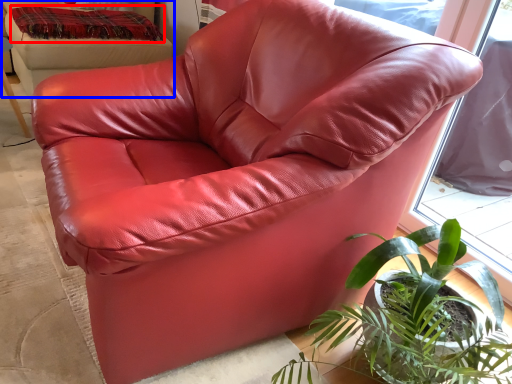
Question: Among these objects, which one is farthest to the camera, blanket (highlighted by a red box) or bean bag chair (highlighted by a blue box)?

Choices:
 (A) blanket
 (B) bean bag chair

Answer: (A)